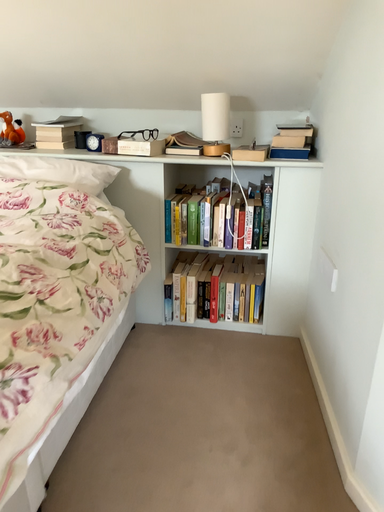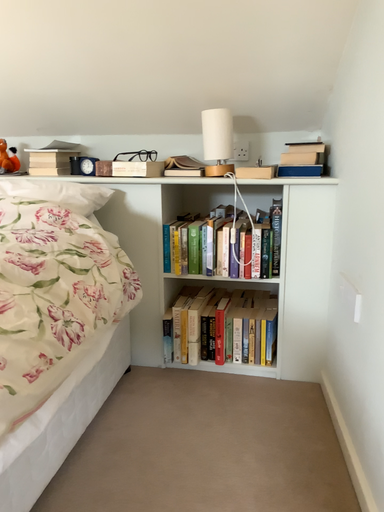
Question: Which way did the camera rotate in the video?

Choices:
 (A) rotated upward
 (B) rotated downward

Answer: (A)